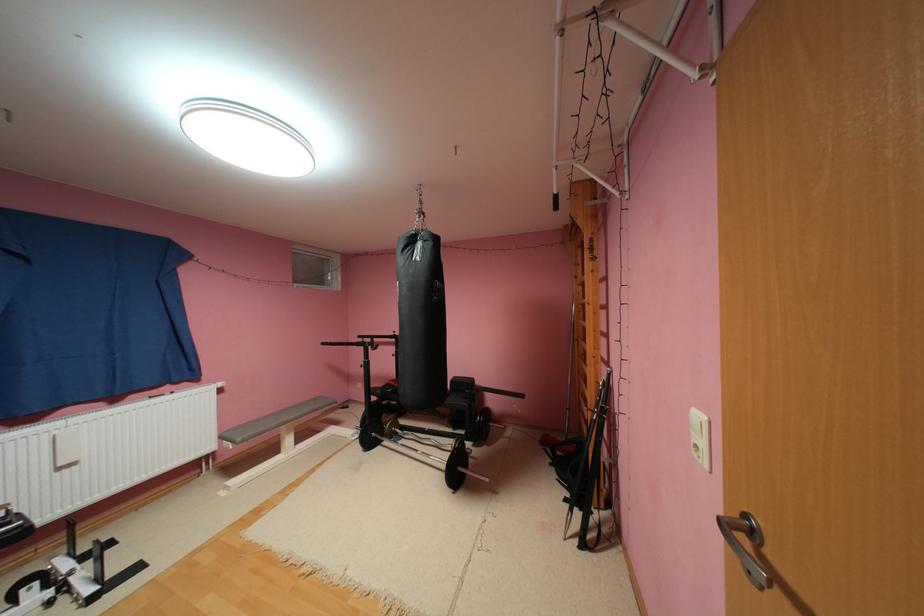
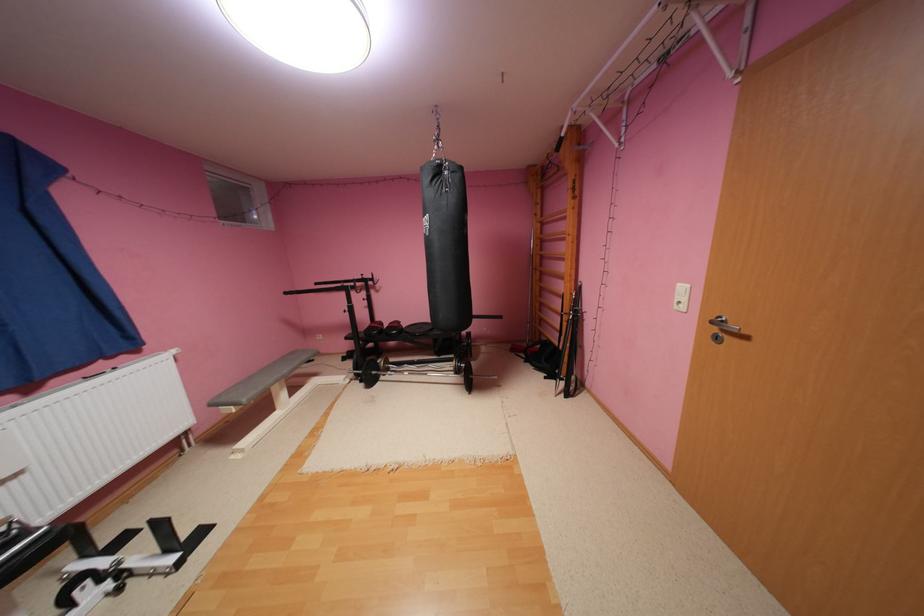
Locate, in the second image, the point that corresponds to [553,442] in the first image.

(524, 350)